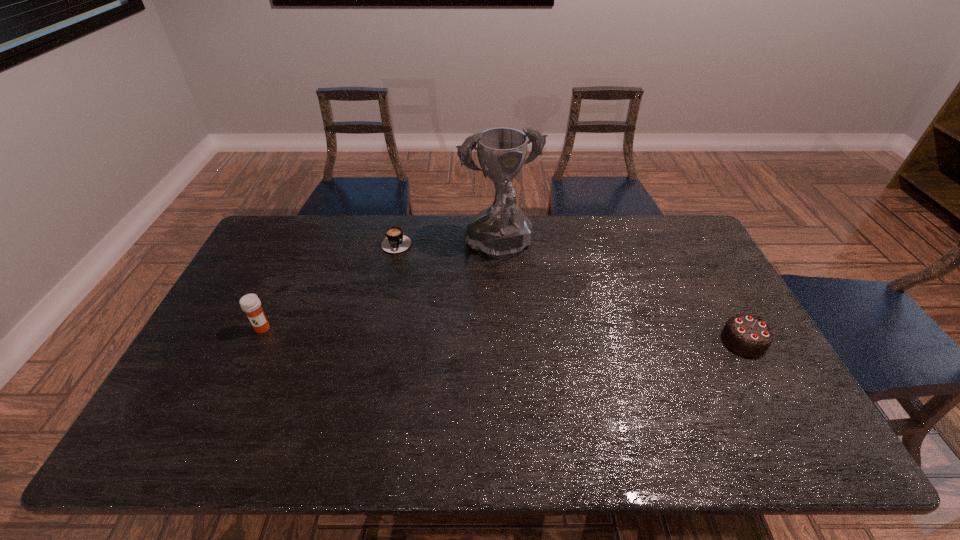
You are a GUI agent. You are given a task and a screenshot of the screen. Output one action in this format:
    pyautogui.click(x=<x>, y=<y>)
    Task: Click on the second tallest object
    
    Given the screenshot: What is the action you would take?
    pyautogui.click(x=250, y=303)

Image resolution: width=960 pixels, height=540 pixels. I want to click on the leftmost object, so click(x=250, y=303).

At what (x,y) coordinates should I click in order to perform the action: click on the rightmost object. Please return your answer as a coordinate pair (x, y). The image size is (960, 540). Looking at the image, I should click on (750, 336).

I want to click on the second shortest object, so click(x=750, y=336).

You are a GUI agent. You are given a task and a screenshot of the screen. Output one action in this format:
    pyautogui.click(x=<x>, y=<y>)
    Task: Click on the award
    This screenshot has height=540, width=960.
    Given the screenshot: What is the action you would take?
    pyautogui.click(x=502, y=230)

Identify the location of the tallest object. The height and width of the screenshot is (540, 960). (502, 230).

Identify the location of the third object from right to left. (396, 242).

The height and width of the screenshot is (540, 960). Find the location of `the shortest object`. the shortest object is located at coordinates (396, 242).

Locate an element on the screen. This screenshot has height=540, width=960. free space located 0.200m on the label side of the leftmost object is located at coordinates (230, 397).

The height and width of the screenshot is (540, 960). I want to click on free region located on the left of the rightmost object, so click(x=683, y=340).